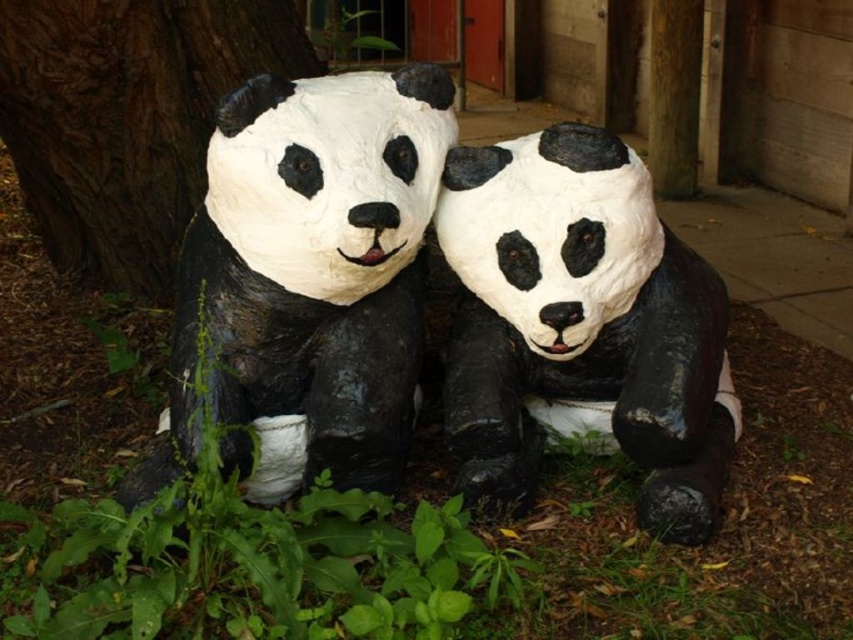
You are a delivery person holding a package that is 3 meters long. You need to move it through the space between the two pandas at point (524, 416). Can you fit the package between them without bending it?

The two pandas at point (524, 416) are 2.49 meters apart. Since the package is 3 meters long, which is longer than the distance between them, the package cannot fit between the pandas without bending.